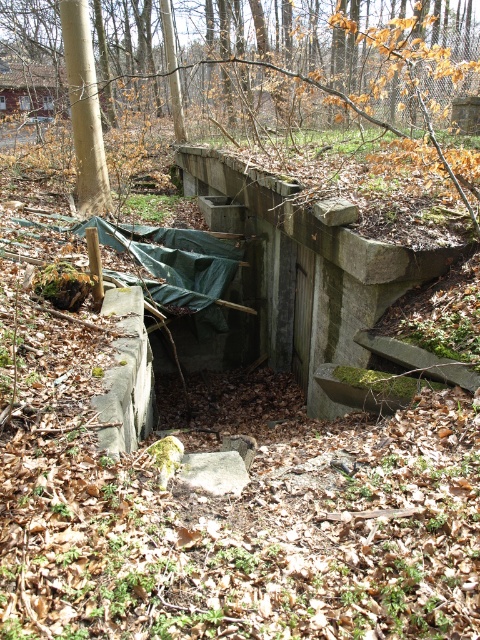
You are standing in the wooded area and want to take a photo of both the brown rough tree at center and the green mossy concrete bunker at center. Which object should you focus on first to ensure both are in sharp focus?

You should focus on the brown rough tree at center first since it is closer to you than the green mossy concrete bunker at center, ensuring both will be in focus when using a camera with a fixed focal plane.

You are a park ranger who needs to place a 10 meter long safety rope between the brown rough tree at center and the green mossy concrete bunker at center. Is the rope long enough to stretch between them?

The distance between the brown rough tree at center and the green mossy concrete bunker at center is 8.99 meters. Since the rope is 10 meters long, it is long enough to stretch between them.

You are a hiker who wants to take a photo of the green mossy concrete bunker at center. However, the brown rough tree at center is blocking your view. Can you move to the right side to get a clear shot without the tree blocking the bunker?

The brown rough tree at center is bigger than the green mossy concrete bunker at center, so moving to the right side might not fully eliminate the tree obstruction. However, since the tree is larger, adjusting your position slightly to the right could provide a partial view of the bunker. For a clearer shot, you might need to move further away or find a higher vantage point to see over the tree.